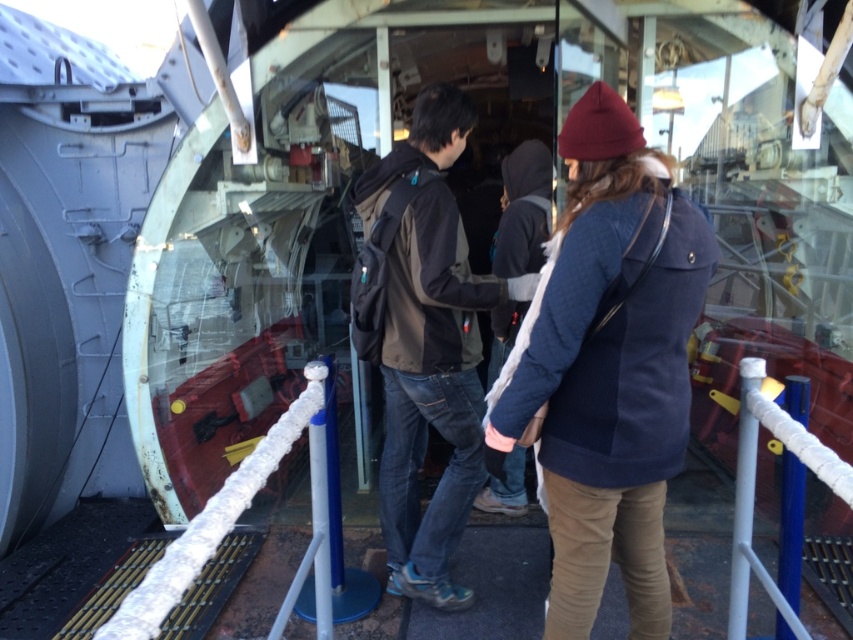
Question: Is navy blue jacket at center wider than dark brown backpack at center?

Choices:
 (A) yes
 (B) no

Answer: (B)

Question: Which point is farther from the camera taking this photo?

Choices:
 (A) (622, 394)
 (B) (454, 428)
 (C) (756, 410)
 (D) (164, 596)

Answer: (B)

Question: Which point is farther to the camera?

Choices:
 (A) (405, 440)
 (B) (753, 400)
 (C) (180, 596)

Answer: (A)

Question: Does navy blue jacket at center have a smaller size compared to white rope at center?

Choices:
 (A) no
 (B) yes

Answer: (A)

Question: Which point is farther to the camera?

Choices:
 (A) (741, 600)
 (B) (471, 600)
 (C) (305, 388)
 (D) (654, 637)

Answer: (B)

Question: Where is dark brown backpack at center located in relation to white rope at lower left in the image?

Choices:
 (A) above
 (B) below

Answer: (A)